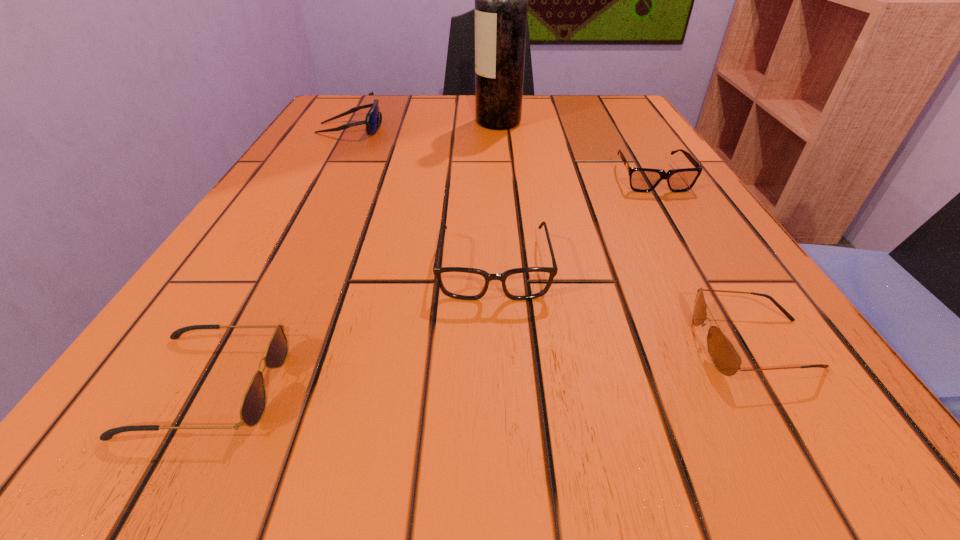
Where is `liquor that is at the far edge`? This screenshot has height=540, width=960. liquor that is at the far edge is located at coordinates (501, 0).

Where is `sunglasses present at the far edge`? The height and width of the screenshot is (540, 960). sunglasses present at the far edge is located at coordinates (373, 119).

In order to click on object that is at the far left corner in this screenshot , I will do `click(373, 119)`.

At what (x,y) coordinates should I click in order to perform the action: click on object present at the near left corner. Please return your answer as a coordinate pair (x, y). Looking at the image, I should click on (253, 405).

Where is `object located at the near right corner`? This screenshot has height=540, width=960. object located at the near right corner is located at coordinates (723, 354).

I want to click on free space at the far edge of the desktop, so click(434, 111).

You are a GUI agent. You are given a task and a screenshot of the screen. Output one action in this format:
    pyautogui.click(x=<x>, y=<y>)
    Task: Click on the free space at the near edge of the desktop
    Image resolution: width=960 pixels, height=540 pixels.
    Given the screenshot: What is the action you would take?
    pyautogui.click(x=324, y=428)

The width and height of the screenshot is (960, 540). In the image, there is a desktop. In order to click on vacant region at the left edge in this screenshot , I will do `click(243, 224)`.

The width and height of the screenshot is (960, 540). What are the coordinates of `blank space at the right edge of the desktop` in the screenshot? It's located at (642, 137).

The image size is (960, 540). Identify the location of free space at the far left corner. (343, 107).